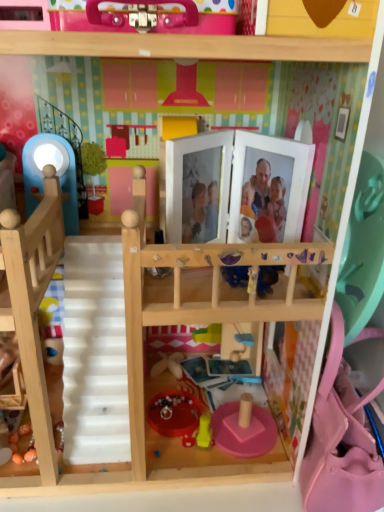
Identify the location of pink fabric purse at right. This screenshot has width=384, height=512. (341, 441).

Describe the element at coordinates (341, 441) in the screenshot. I see `pink fabric purse at right` at that location.

At what (x,y) coordinates should I click in order to perform the action: click on pink fabric purse at right. Please return your answer as a coordinate pair (x, y). This screenshot has width=384, height=512. Looking at the image, I should click on (341, 441).